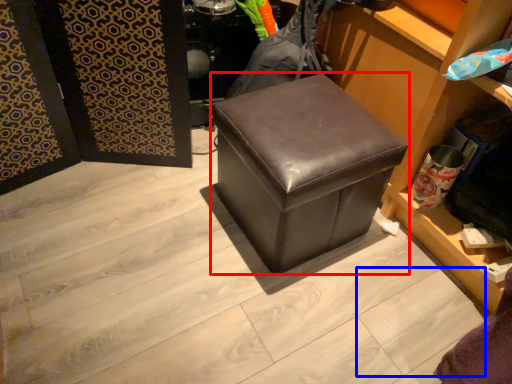
Question: Which of the following is the closest to the observer, furniture (highlighted by a red box) or square (highlighted by a blue box)?

Choices:
 (A) furniture
 (B) square

Answer: (B)